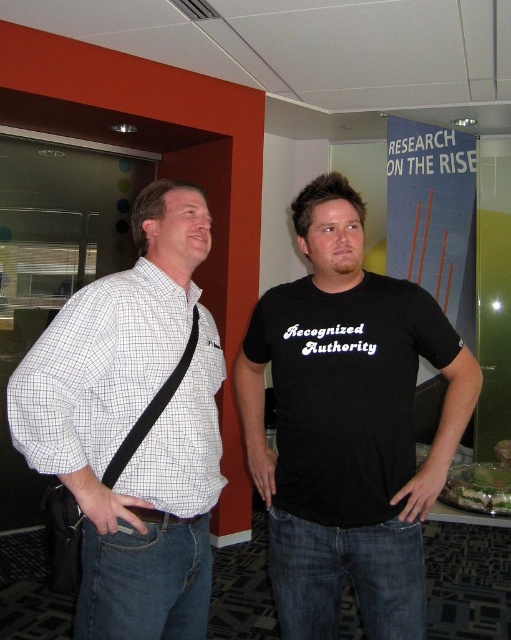
Between black cotton t-shirt at center and white checkered shirt at center, which one is positioned lower?

black cotton t-shirt at center is lower down.

Measure the distance from black cotton t-shirt at center to white checkered shirt at center.

black cotton t-shirt at center and white checkered shirt at center are 14.35 inches apart.

Find the location of `black cotton t-shirt at center`. black cotton t-shirt at center is located at coordinates (346, 426).

You are a GUI agent. You are given a task and a screenshot of the screen. Output one action in this format:
    pyautogui.click(x=<x>, y=<y>)
    Task: Click on the black cotton t-shirt at center
    Image resolution: width=511 pixels, height=640 pixels.
    Given the screenshot: What is the action you would take?
    pyautogui.click(x=346, y=426)